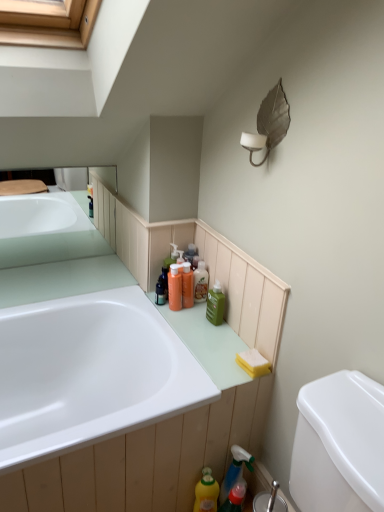
Find the location of a particular element. vacant point to the left of yellow sponge at lower right is located at coordinates click(x=208, y=362).